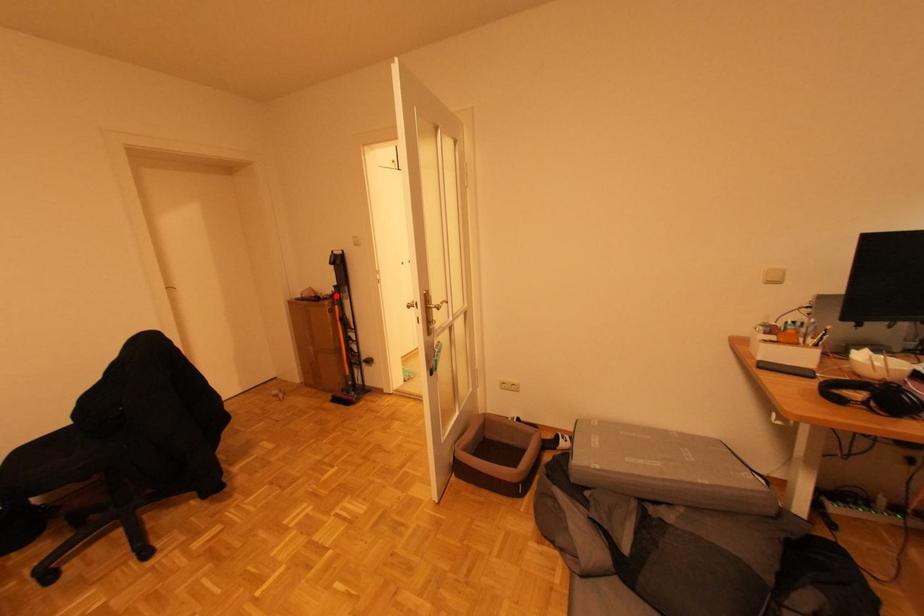
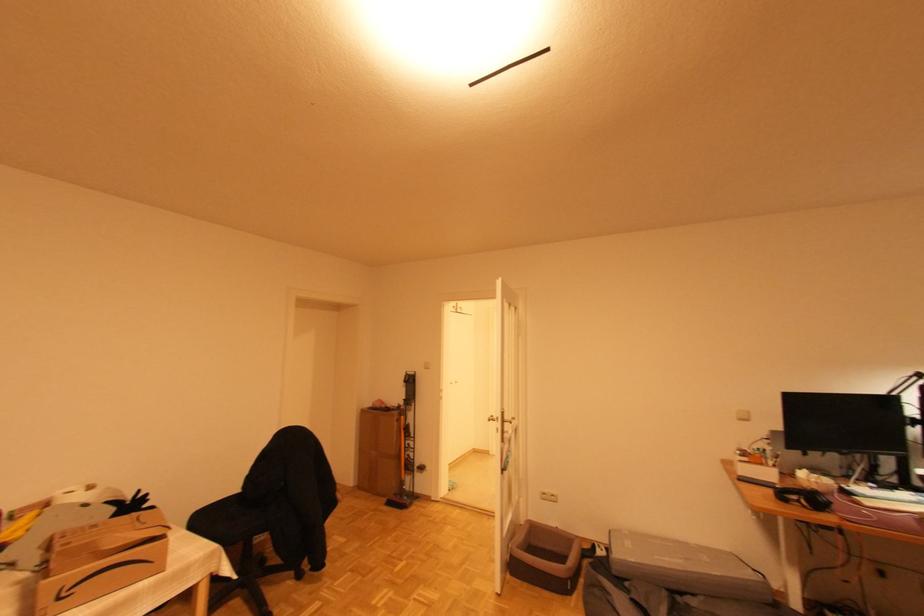
Question: I am providing you with two images of the same scene from different viewpoints. A red point is shown in image1. For the corresponding object point in image2, is it positioned nearer or farther from the camera?

Choices:
 (A) Nearer
 (B) Farther

Answer: (B)